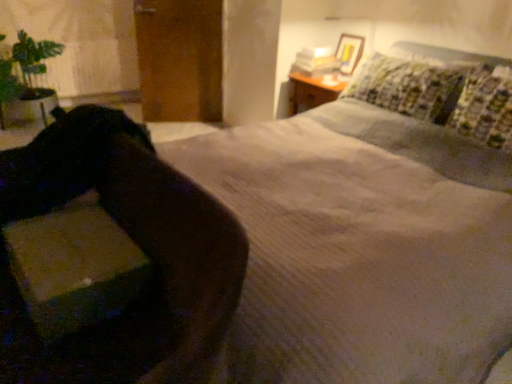
Question: From the image's perspective, is velvet-like brown swivel chair at lower left on matte cardboard box at lower left?

Choices:
 (A) no
 (B) yes

Answer: (A)

Question: Can matte cardboard box at lower left be found inside velvet-like brown swivel chair at lower left?

Choices:
 (A) yes
 (B) no

Answer: (A)

Question: Can we say velvet-like brown swivel chair at lower left lies outside matte cardboard box at lower left?

Choices:
 (A) yes
 (B) no

Answer: (A)

Question: Can you confirm if velvet-like brown swivel chair at lower left is thinner than matte cardboard box at lower left?

Choices:
 (A) yes
 (B) no

Answer: (B)

Question: Is velvet-like brown swivel chair at lower left at the right side of matte cardboard box at lower left?

Choices:
 (A) no
 (B) yes

Answer: (A)

Question: Looking at the image, does matte cardboard box at lower left seem bigger or smaller compared to velvet-like brown swivel chair at lower left?

Choices:
 (A) big
 (B) small

Answer: (B)

Question: Does point (89, 276) appear closer or farther from the camera than point (113, 124)?

Choices:
 (A) closer
 (B) farther

Answer: (A)

Question: From the image's perspective, is matte cardboard box at lower left above or below velvet-like brown swivel chair at lower left?

Choices:
 (A) below
 (B) above

Answer: (B)

Question: In the image, is matte cardboard box at lower left on the left side or the right side of velvet-like brown swivel chair at lower left?

Choices:
 (A) left
 (B) right

Answer: (B)

Question: From the image's perspective, is matte cardboard box at lower left above or below green leafy plant at left?

Choices:
 (A) above
 (B) below

Answer: (B)

Question: Is matte cardboard box at lower left in front of or behind green leafy plant at left in the image?

Choices:
 (A) behind
 (B) front

Answer: (B)

Question: Is matte cardboard box at lower left wider or thinner than green leafy plant at left?

Choices:
 (A) wide
 (B) thin

Answer: (B)

Question: Do you think matte cardboard box at lower left is within green leafy plant at left, or outside of it?

Choices:
 (A) inside
 (B) outside

Answer: (B)

Question: From the image's perspective, relative to velvet-like brown swivel chair at lower left, is green leafy plant at left above or below?

Choices:
 (A) above
 (B) below

Answer: (A)

Question: From a real-world perspective, relative to velvet-like brown swivel chair at lower left, is green leafy plant at left vertically above or below?

Choices:
 (A) above
 (B) below

Answer: (A)